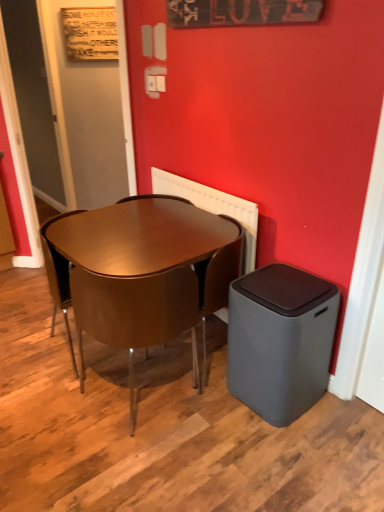
Find the location of a particular element. This screenshot has height=512, width=384. free space above brown leather chair at center, marked as the 2th chair in a right-to-left arrangement (from a real-world perspective) is located at coordinates (132, 257).